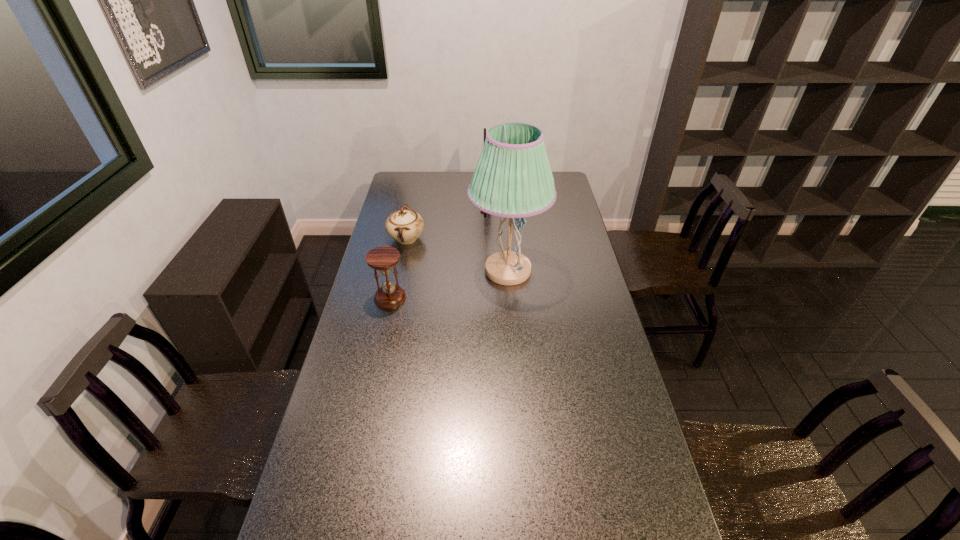
Where is `free point that satisfies the following two spatial constraints: 1. on the screen side of the third shortest object; 2. on the front side of the chinaware`? free point that satisfies the following two spatial constraints: 1. on the screen side of the third shortest object; 2. on the front side of the chinaware is located at coordinates pos(491,239).